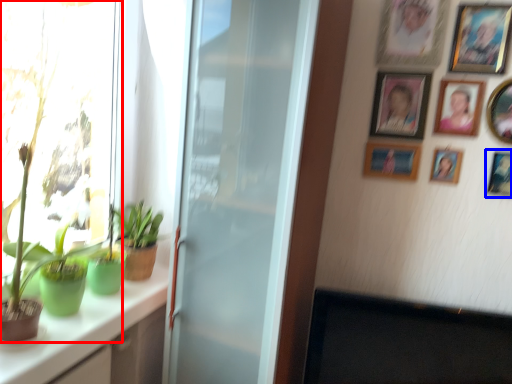
Question: Which point is further to the camera, houseplant (highlighted by a red box) or picture frame (highlighted by a blue box)?

Choices:
 (A) houseplant
 (B) picture frame

Answer: (B)